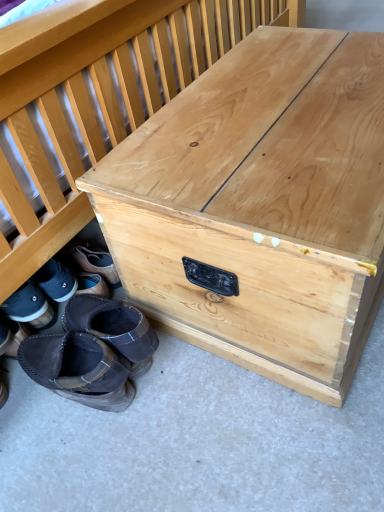
Find the location of a particular element. This screenshot has width=384, height=512. vacant area on top of brown suede boot at lower left, the fourth footwear in the left-to-right sequence (from a real-world perspective) is located at coordinates (81, 368).